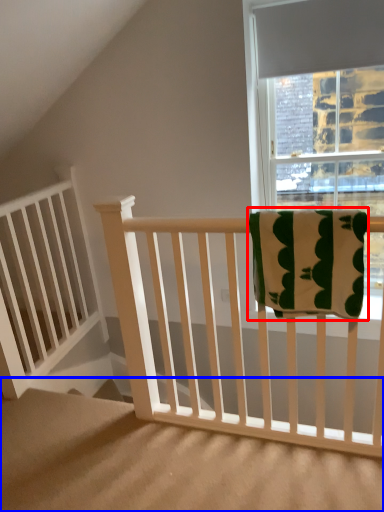
Question: Which object appears farthest to the camera in this image, beach towel (highlighted by a red box) or stairs (highlighted by a blue box)?

Choices:
 (A) beach towel
 (B) stairs

Answer: (A)